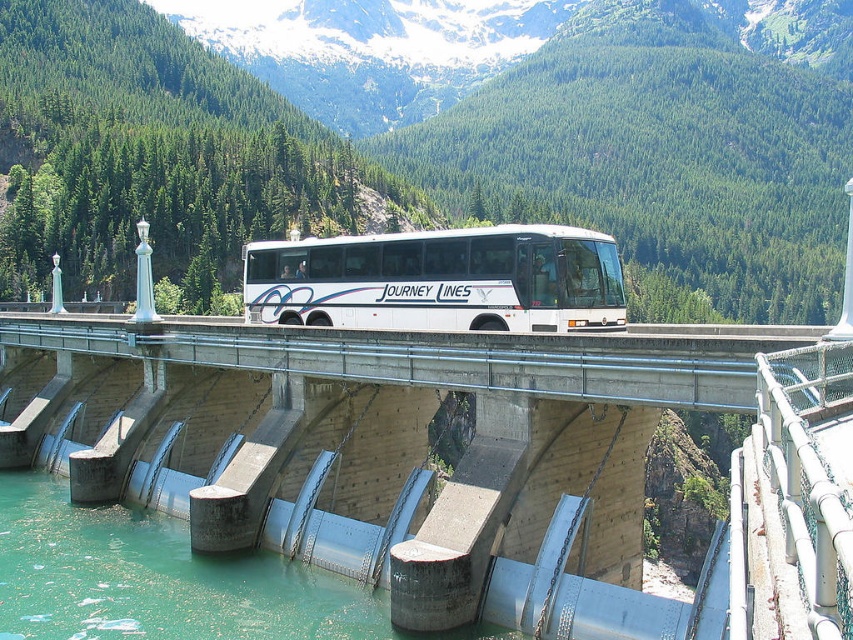
You are standing on the dam and want to walk from point (x=239, y=182) to point (x=312, y=312). Which direction should you face to move towards the latter point?

You should face towards the background of the image because point (x=312, y=312) is further away from the viewer compared to point (x=239, y=182).

You are a tour guide standing on the concrete bridge at center. You want to show tourists the green concrete water at lower left. Which direction should you point your hand?

The concrete bridge at center is positioned over the green concrete water at lower left, so you should point downward toward the green concrete water at lower left.

You are standing on the dam where the white bus labeled Journey Lines is parked. Looking towards the point marked at coordinate (439, 154), what natural feature do you see in that direction?

Looking towards the point marked at coordinate (439, 154), you see the green forested mountain at upper center.